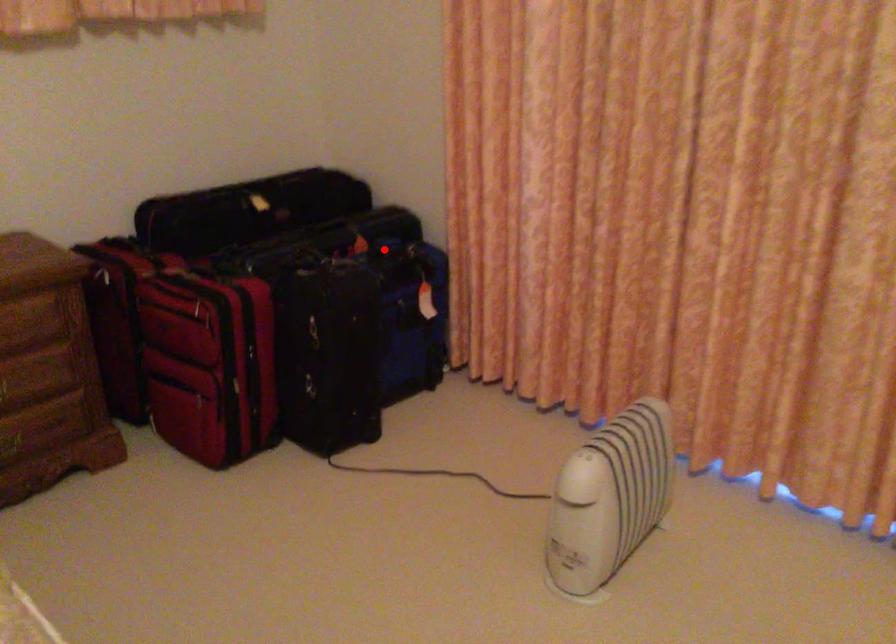
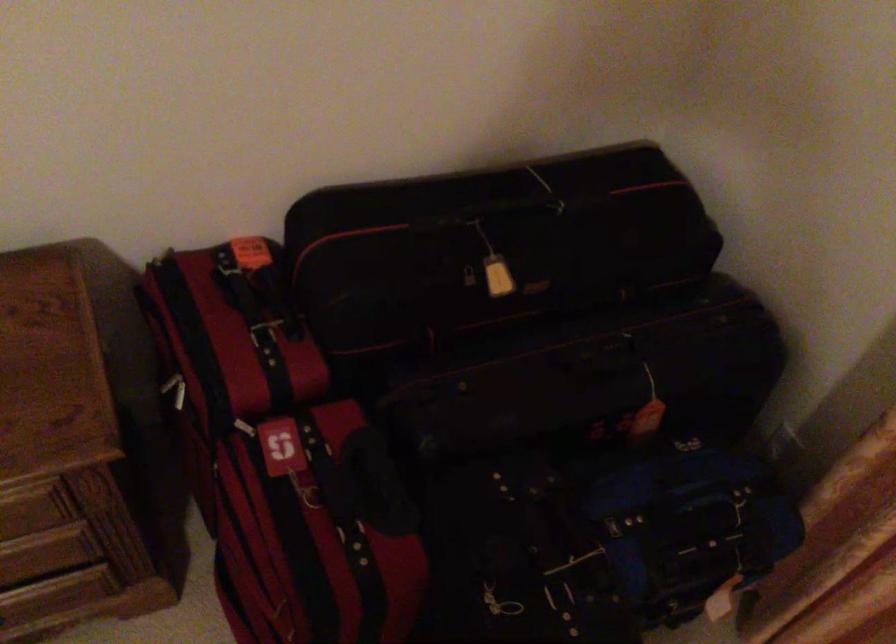
Find the pixel in the second image that matches the highlighted location in the first image.

(676, 507)